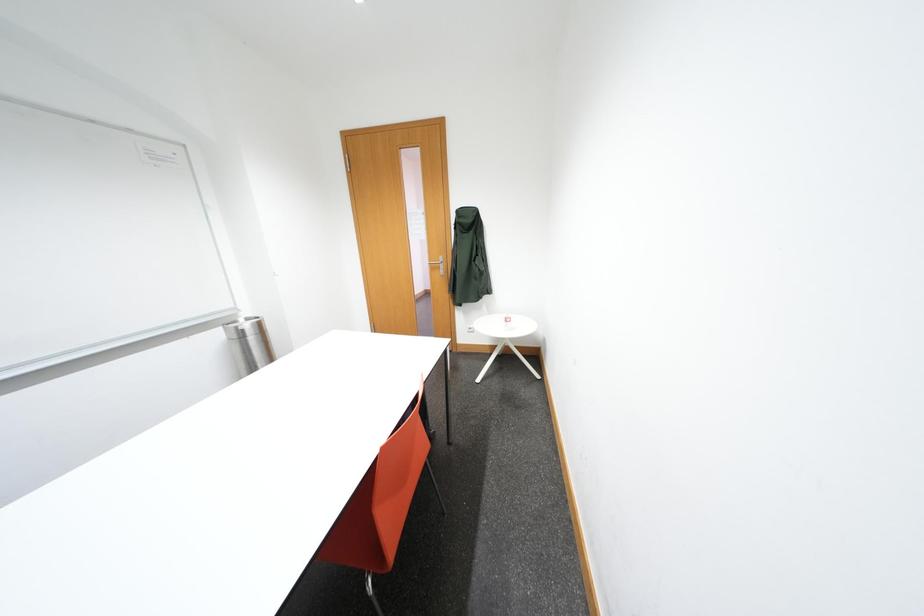
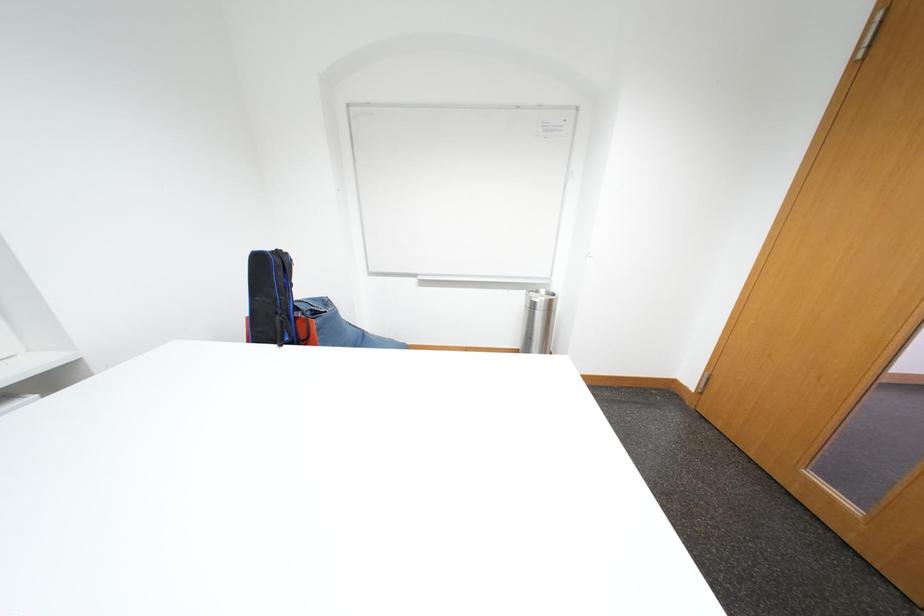
Based on the continuous images, in which direction is the camera rotating?

The camera's rotation is toward left-down.